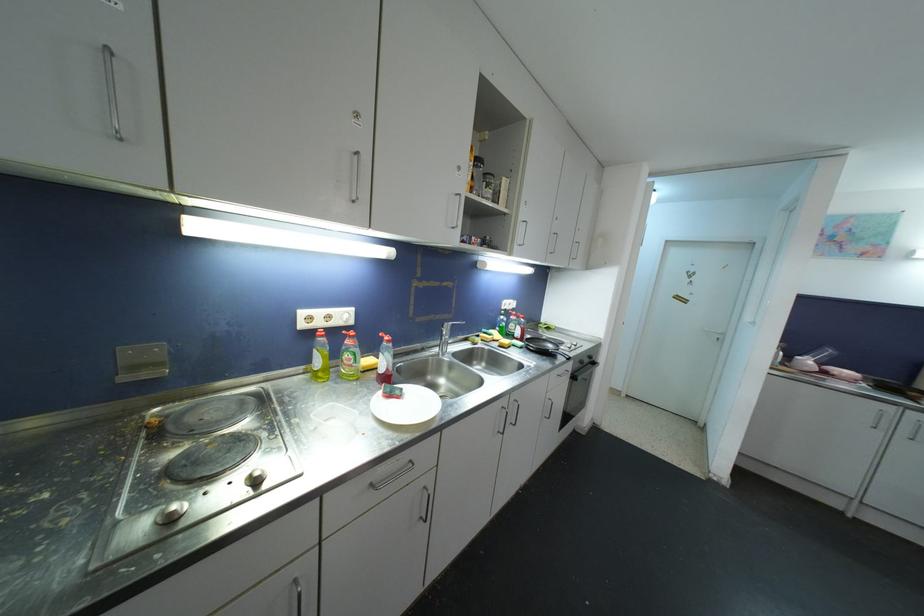
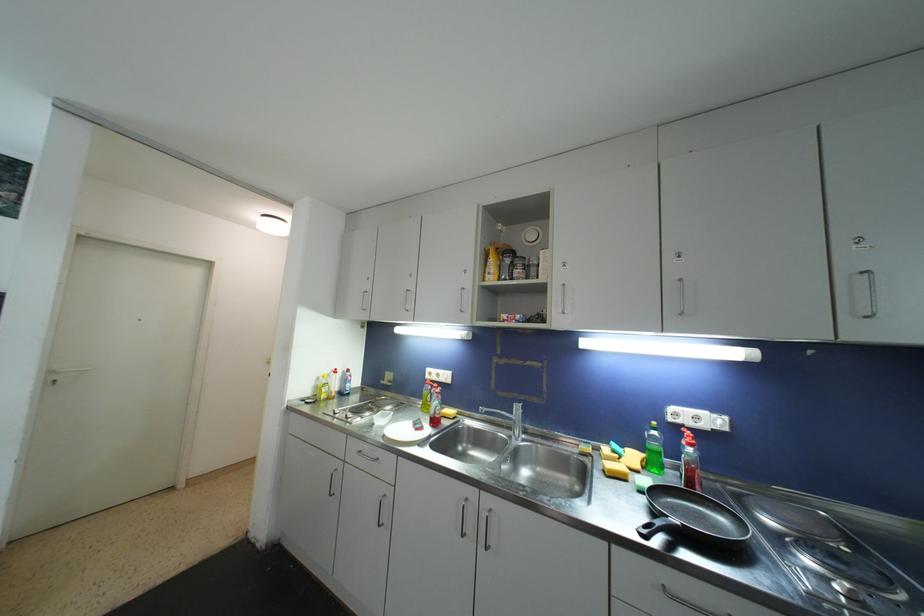
Question: I am providing you with two images of the same scene from different viewpoints. After the viewpoint changes to image2, which objects are now occluded?

Choices:
 (A) white power outlet
 (B) green soap bottle
 (C) red spray bottle
 (D) none of these

Answer: (D)